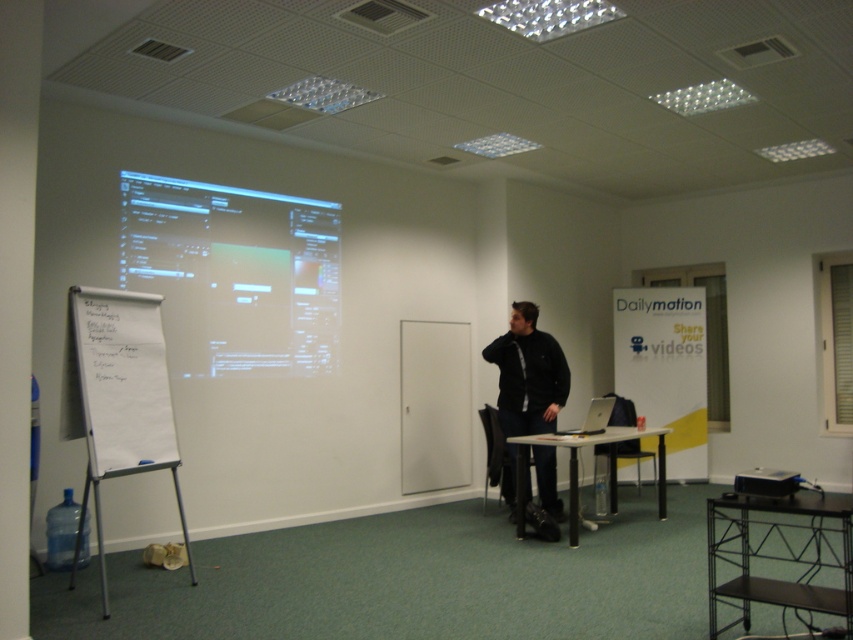
Question: Is matte white projection screen at upper left bigger than white paper at left?

Choices:
 (A) no
 (B) yes

Answer: (B)

Question: Which point is closer to the camera?

Choices:
 (A) black plastic table at center
 (B) white paperboard at left
 (C) black plastic projector at lower right
 (D) black metal table at lower right

Answer: (B)

Question: Can you confirm if white paperboard at left is smaller than black metal table at lower right?

Choices:
 (A) no
 (B) yes

Answer: (B)

Question: Can you confirm if matte white projection screen at upper left is positioned to the right of black metal table at lower right?

Choices:
 (A) no
 (B) yes

Answer: (A)

Question: Which point is farther from the camera taking this photo?

Choices:
 (A) (792, 496)
 (B) (525, 323)

Answer: (B)

Question: Which of the following is the farthest from the observer?

Choices:
 (A) (88, 360)
 (B) (602, 419)

Answer: (B)